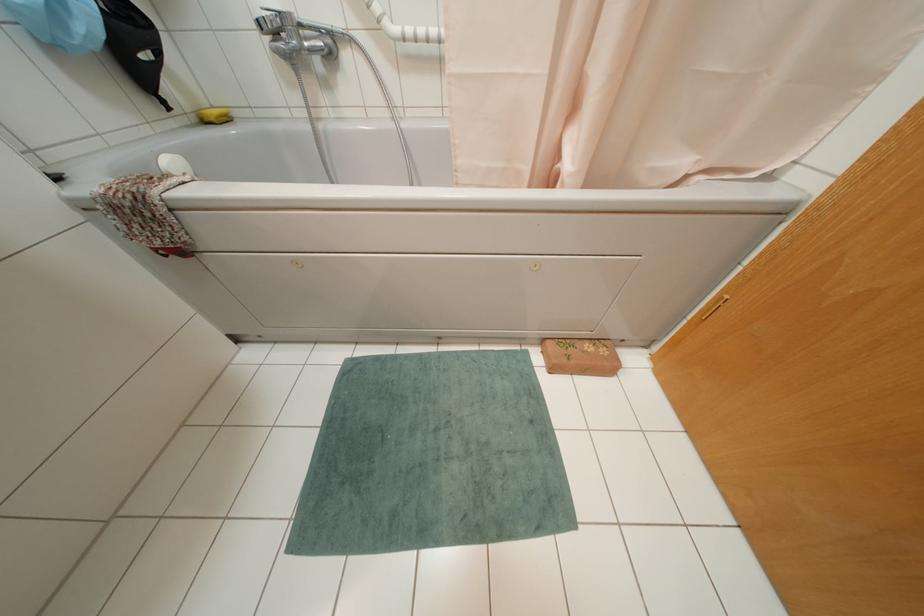
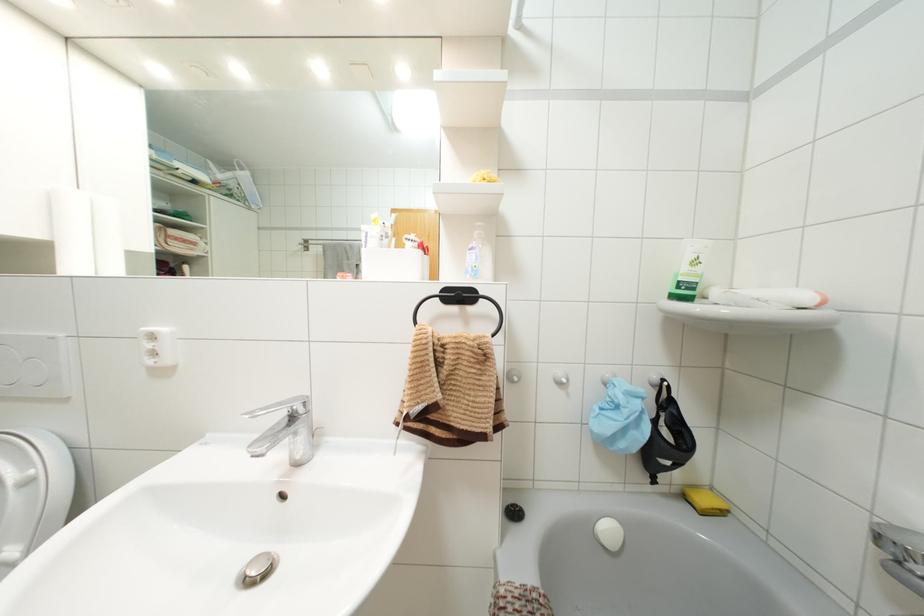
Question: The camera is either moving clockwise (left) or counter-clockwise (right) around the object. The first image is from the beginning of the video and the second image is from the end. Is the camera moving left or right when shooting the video?

Choices:
 (A) Left
 (B) Right

Answer: (B)